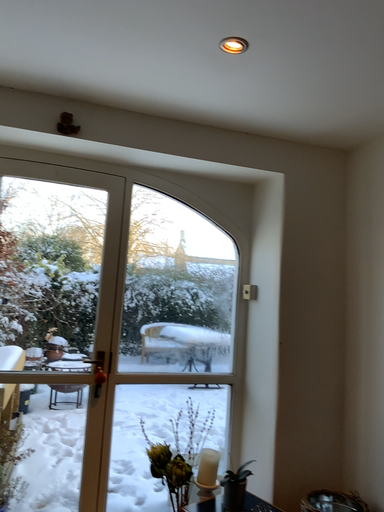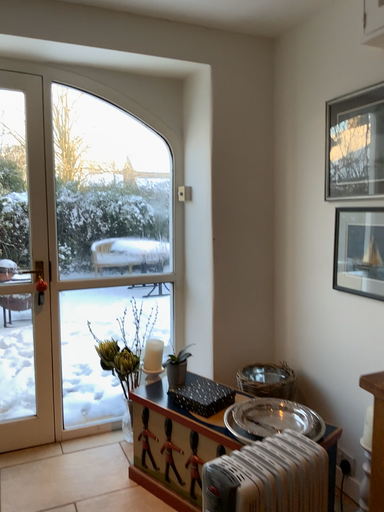
Question: Which way did the camera rotate in the video?

Choices:
 (A) rotated downward
 (B) rotated upward

Answer: (A)